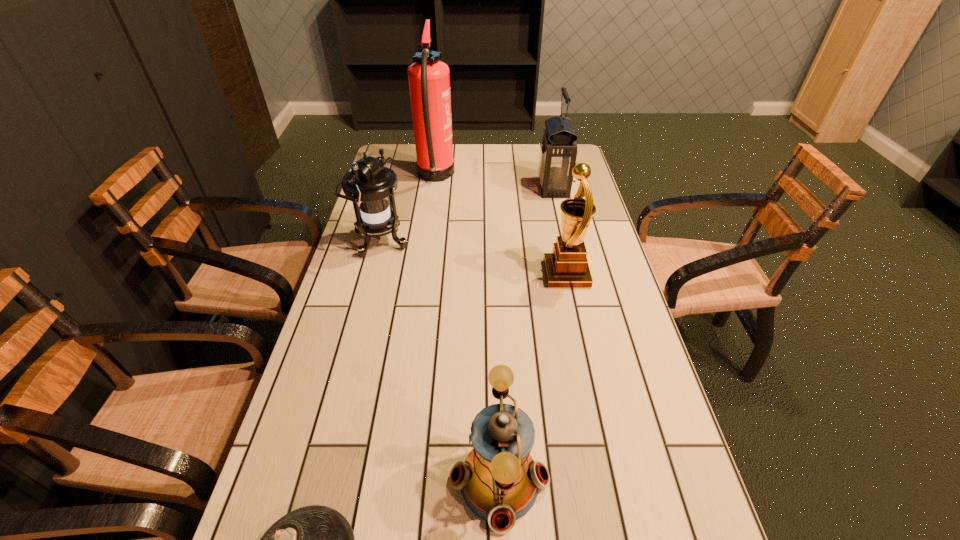
Locate an element on the screen. The image size is (960, 540). award that is at the right edge is located at coordinates 566,267.

Identify the location of lantern located at the right edge. (558, 151).

This screenshot has height=540, width=960. What are the coordinates of `object that is at the far left corner` in the screenshot? It's located at (429, 78).

The height and width of the screenshot is (540, 960). I want to click on vacant area at the far edge, so click(x=476, y=167).

In the image, there is a desktop. Identify the location of free space at the right edge. This screenshot has width=960, height=540. (579, 183).

At what (x,y) coordinates should I click in order to perform the action: click on vacant space that's between the second farthest lantern and the tallest object. Please return your answer as a coordinate pair (x, y). The height and width of the screenshot is (540, 960). Looking at the image, I should click on (408, 210).

The height and width of the screenshot is (540, 960). I want to click on empty space between the award and the rightmost lantern, so click(560, 231).

Find the location of a particular element. free spot between the award and the second nearest lantern is located at coordinates (473, 258).

Where is `vacant point located between the award and the farthest lantern`? The width and height of the screenshot is (960, 540). vacant point located between the award and the farthest lantern is located at coordinates (560, 231).

Where is `unoccupied position between the shortest lantern and the award`? This screenshot has width=960, height=540. unoccupied position between the shortest lantern and the award is located at coordinates (533, 377).